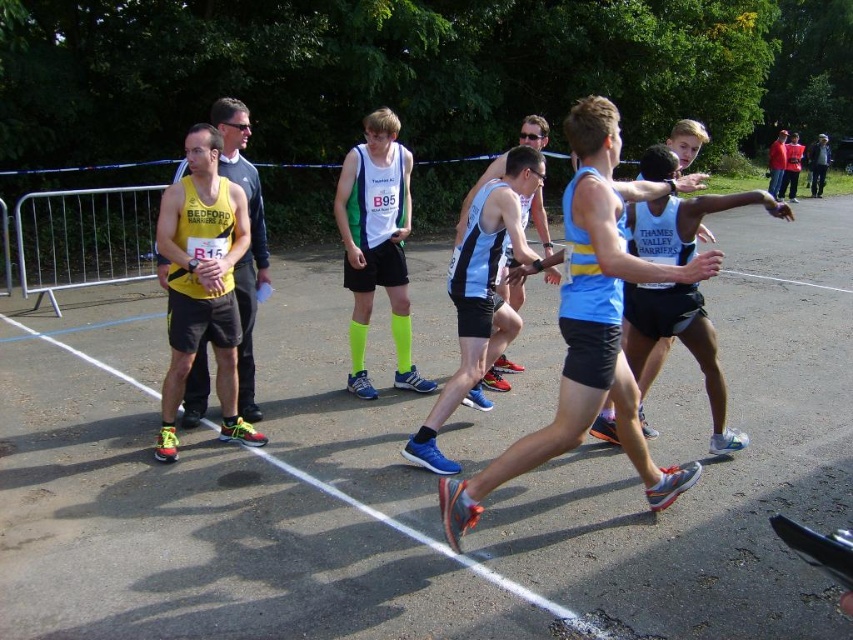
In the scene shown: You are a photographer positioned at the starting line of the race. You want to capture both the neon green fabric shorts at center and the light blue mesh tank top at center in your shot. Which clothing item will appear closer to the camera in the photo?

The neon green fabric shorts at center will appear closer to the camera because it is further to the viewer than the light blue mesh tank top at center.

You are a photographer at the running event and want to capture both the yellow matte tank top at left and the red jacket at upper right in a single shot. Which object should you focus on first to ensure both are in frame?

The yellow matte tank top at left is shorter than the red jacket at upper right, so focus on the red jacket at upper right first to ensure both are in frame.

You are a photographer at the race starting area. You need to capture a photo that includes both the yellow matte tank top at left and the red jacket at upper right. Based on their positions, which object should you focus on first to ensure both are in frame?

The yellow matte tank top at left is positioned under the red jacket at upper right, so you should focus on the red jacket at upper right first to ensure both are in frame.